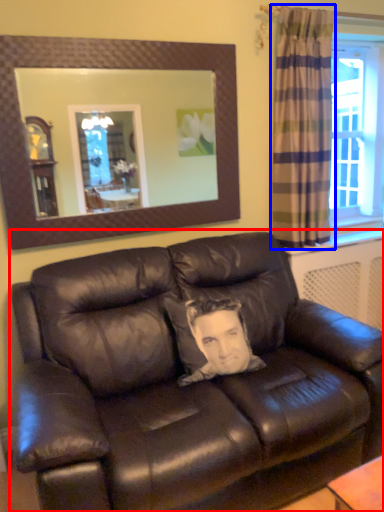
Question: Which of the following is the farthest to the observer, studio couch (highlighted by a red box) or curtain (highlighted by a blue box)?

Choices:
 (A) studio couch
 (B) curtain

Answer: (B)